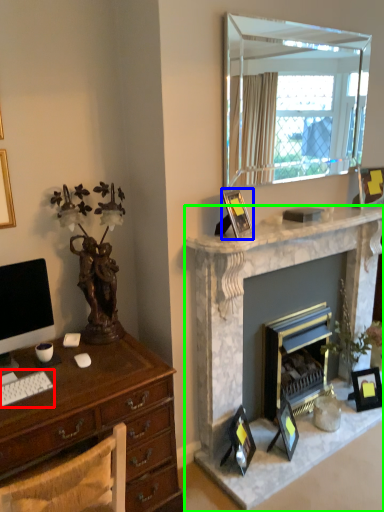
Question: Considering the real-world distances, which object is closest to computer keyboard (highlighted by a red box)? picture frame (highlighted by a blue box) or fireplace (highlighted by a green box).

Choices:
 (A) picture frame
 (B) fireplace

Answer: (A)